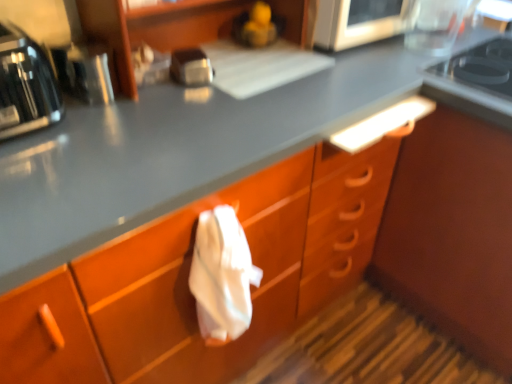
At what (x,y) coordinates should I click in order to perform the action: click on vacant area that is in front of metallic silver toaster at left, the first appliance in the front-to-back sequence. Please return your answer as a coordinate pair (x, y). Looking at the image, I should click on (80, 131).